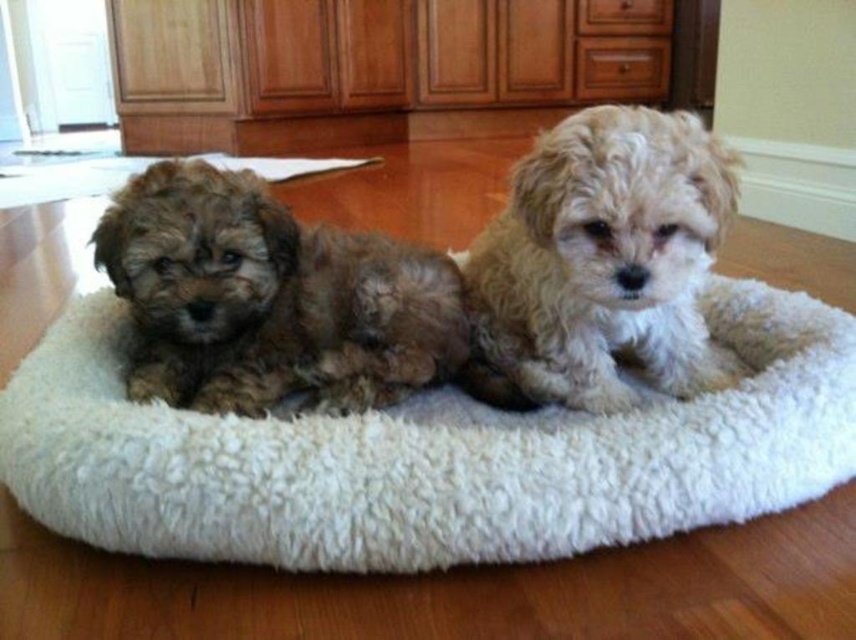
Between white fluffy dog bed at center and fuzzy brown dog at left, which one is positioned lower?

Positioned lower is white fluffy dog bed at center.

Measure the distance between point (117,531) and camera.

They are 83.04 centimeters apart.

Is point (21, 504) farther from viewer compared to point (383, 330)?

No, (21, 504) is closer to viewer.

Locate an element on the screen. white fluffy dog bed at center is located at coordinates (428, 454).

Who is more distant from viewer, (292,314) or (658,209)?

Positioned behind is point (292,314).

At what (x,y) coordinates should I click in order to perform the action: click on fuzzy brown dog at left. Please return your answer as a coordinate pair (x, y). Looking at the image, I should click on (x=270, y=298).

Is point (189, 547) in front of point (568, 209)?

Yes, it is.

Is white fluffy dog bed at center positioned in front of fuzzy beige dog at center?

Yes, it is in front of fuzzy beige dog at center.

This screenshot has width=856, height=640. Identify the location of white fluffy dog bed at center. (428, 454).

This screenshot has width=856, height=640. What are the coordinates of `white fluffy dog bed at center` in the screenshot? It's located at (428, 454).